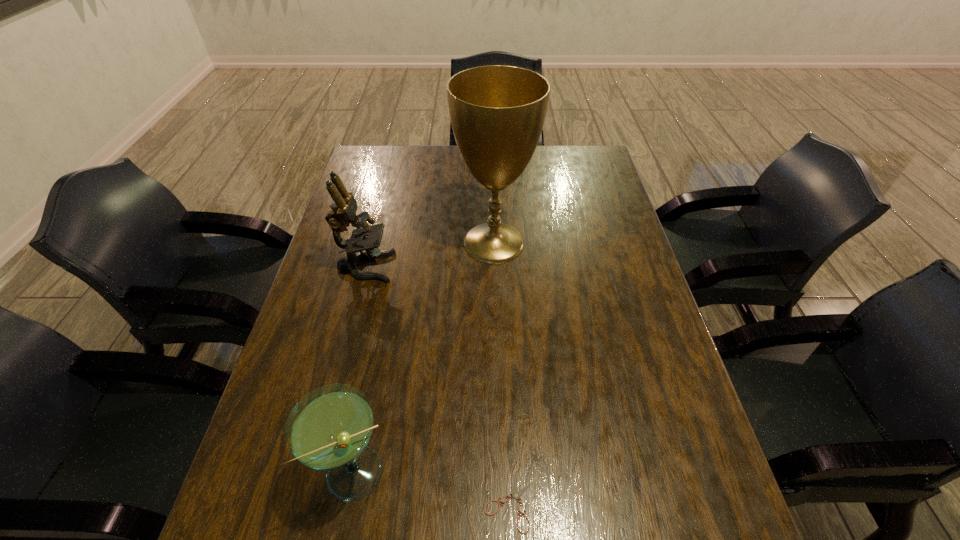
Locate an element on the screen. Image resolution: width=960 pixels, height=540 pixels. unoccupied area between the trophy cup and the shortest object is located at coordinates (501, 373).

At what (x,y) coordinates should I click in order to perform the action: click on free spot between the microscope and the tallest object. Please return your answer as a coordinate pair (x, y). Looking at the image, I should click on (430, 254).

Locate an element on the screen. The height and width of the screenshot is (540, 960). vacant region between the third tallest object and the tallest object is located at coordinates (425, 357).

Select which object appears as the second closest to the third tallest object. Please provide its 2D coordinates. Your answer should be formatted as a tuple, i.e. [(x, y)], where the tuple contains the x and y coordinates of a point satisfying the conditions above.

[(343, 213)]

In order to click on object that ranks as the closest to the trophy cup in this screenshot , I will do `click(343, 213)`.

I want to click on free spot that satisfies the following two spatial constraints: 1. on the back side of the shears; 2. at the eyepieces of the microscope, so click(498, 267).

Find the location of a particular element. The height and width of the screenshot is (540, 960). vacant space that satisfies the following two spatial constraints: 1. on the back side of the shortest object; 2. at the eyepieces of the third shortest object is located at coordinates (498, 267).

The width and height of the screenshot is (960, 540). In order to click on free region that satisfies the following two spatial constraints: 1. at the eyepieces of the microscope; 2. on the back side of the shortest object in this screenshot , I will do `click(304, 503)`.